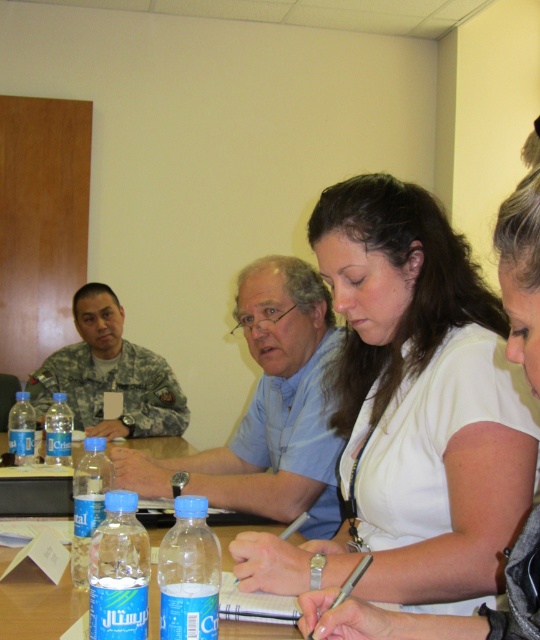
Question: Which point is closer to the camera?

Choices:
 (A) (60, 445)
 (B) (114, 522)
 (C) (42, 404)

Answer: (B)

Question: Is white matte shirt at center closer to the viewer compared to clear plastic bottles at center?

Choices:
 (A) no
 (B) yes

Answer: (B)

Question: Is the position of translucent plastic bottle at lower left more distant than that of blue plastic bottle at lower left?

Choices:
 (A) yes
 (B) no

Answer: (B)

Question: Estimate the real-world distances between objects in this image. Which object is farther from the clear plastic bottle at left?

Choices:
 (A) clear plastic bottle at lower left
 (B) blue plastic bottle at lower left

Answer: (A)

Question: Is the position of white matte shirt at center less distant than that of clear plastic bottle at lower left?

Choices:
 (A) no
 (B) yes

Answer: (B)

Question: Which of the following is the farthest from the observer?

Choices:
 (A) clear plastic bottle at left
 (B) camouflage uniform at left
 (C) blue shirt at center

Answer: (B)